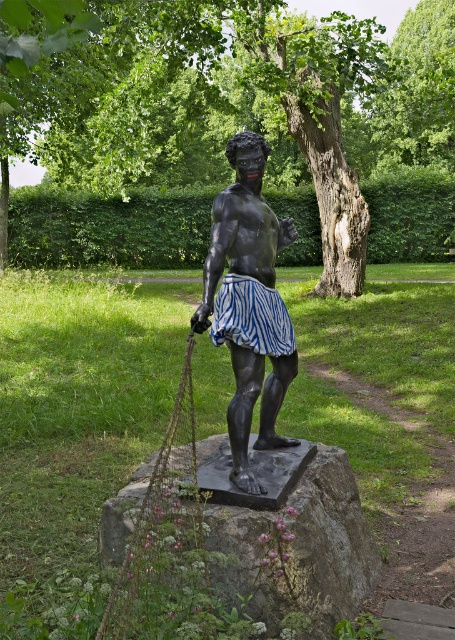
You are a photographer trying to capture the statue from the best angle. You notice two points marked in the image at coordinates point (248, 195) and point (429, 113). Which point is positioned closer to your camera lens?

Point (248, 195) is closer to the camera than point (429, 113).

You are a gardener who needs to trim the branches of both the green textured tree at center and the green leafy tree at upper center. Based on their heights, which tree should you prioritize using a taller ladder?

The green textured tree at center should be prioritized with a taller ladder since it has a greater height compared to the green leafy tree at upper center.